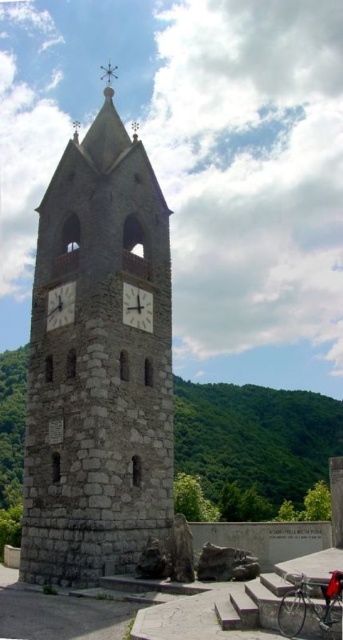
You are a tourist standing in front of the stone clock tower at center and the white stone clock at center. Which structure is closer to you?

The stone clock tower at center is closer to you because it is in front of the white stone clock at center.

You are a painter who wants to paint both the stone clock tower at center and the smooth gray clock at center. You have a canvas that is 1 meter wide. If you want to paint them side by side, will they fit on the canvas?

The stone clock tower at center might be wider than smooth gray clock at center. Since the combined width of both objects could exceed the 1 meter canvas, it is uncertain if they will fit without further measurements.

You are a tourist visiting the clock tower and want to take a photo that includes both the stone clock tower at center and the smooth gray clock at center. Since you want to ensure both are fully visible, which object should you position closer to the camera to avoid cropping?

The smooth gray clock at center is smaller than the stone clock tower at center. To ensure both are fully visible in the photo, position the smooth gray clock at center closer to the camera so its smaller size can be captured without cropping.